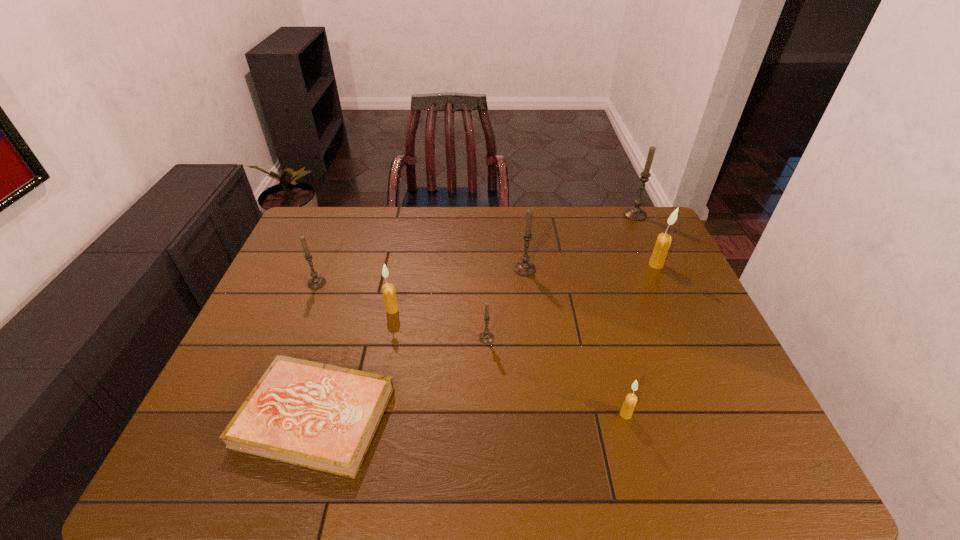
I want to click on free space at the near edge of the desktop, so click(x=583, y=448).

The image size is (960, 540). In order to click on free space at the left edge of the desktop in this screenshot , I will do `click(329, 262)`.

In the image, there is a desktop. Identify the location of vacant area at the far left corner. (295, 241).

Locate an element on the screen. This screenshot has width=960, height=540. free spot at the near left corner of the desktop is located at coordinates (205, 460).

The image size is (960, 540). Identify the location of vacant space at the far right corner of the desktop. (643, 209).

The width and height of the screenshot is (960, 540). I want to click on free area in between the second gray candle from right to left and the biggest gray candle, so pos(580,242).

Find the location of a particular element. The image size is (960, 540). blank region between the fifth object from left to right and the shortest object is located at coordinates [x=420, y=343].

You are a GUI agent. You are given a task and a screenshot of the screen. Output one action in this format:
    pyautogui.click(x=<x>, y=<y>)
    Task: Click on the blank region between the third biggest gray candle and the farthest cream candle
    
    Given the screenshot: What is the action you would take?
    pos(487,274)

This screenshot has height=540, width=960. I want to click on vacant space in between the shortest object and the third object from right to left, so pos(470,415).

Identify the location of vacant region between the fifth farthest candle and the tallest candle. Image resolution: width=960 pixels, height=540 pixels. (514, 262).